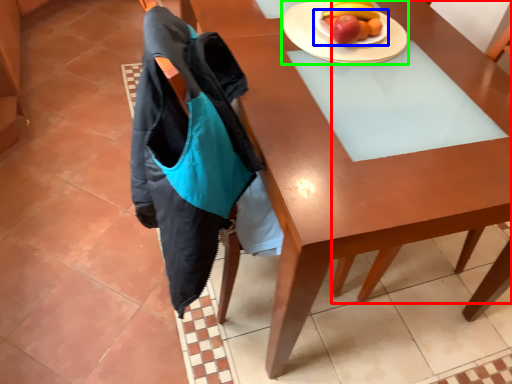
Question: Based on their relative distances, which object is nearer to chair (highlighted by a red box)? Choose from plate (highlighted by a blue box) and plate (highlighted by a green box).

Choices:
 (A) plate
 (B) plate

Answer: (B)